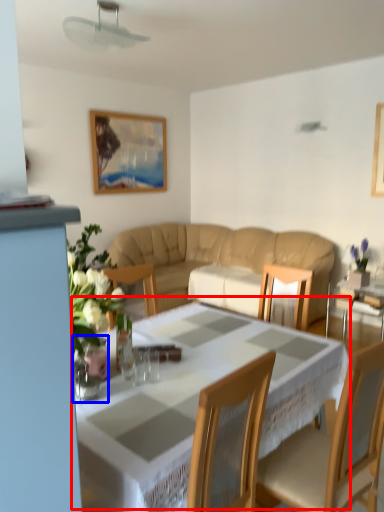
Question: Which object appears farthest to the camera in this image, table (highlighted by a red box) or glass vase (highlighted by a blue box)?

Choices:
 (A) table
 (B) glass vase

Answer: (B)